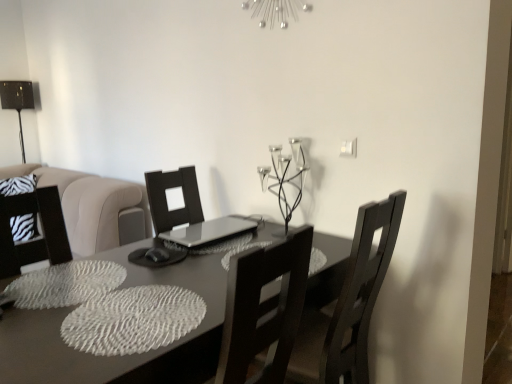
Describe the element at coordinates (119, 356) in the screenshot. I see `matte gray table at center` at that location.

What do you see at coordinates (349, 304) in the screenshot?
I see `dark wood chair at center` at bounding box center [349, 304].

In order to click on metallic black table lamp at left in this screenshot , I will do `click(17, 102)`.

Locate an element on the screen. silver metallic light fixture at upper center is located at coordinates (275, 11).

Does metallic black candle holder at upper center contain metallic black table lamp at left?

That's incorrect, metallic black table lamp at left is not inside metallic black candle holder at upper center.

Considering the sizes of objects metallic black candle holder at upper center and metallic black table lamp at left in the image provided, who is thinner, metallic black candle holder at upper center or metallic black table lamp at left?

metallic black table lamp at left is thinner.

I want to click on table lamp to the left of metallic black candle holder at upper center, so click(x=17, y=102).

Is metallic black candle holder at upper center facing towards metallic black table lamp at left?

No, metallic black candle holder at upper center is not facing towards metallic black table lamp at left.

From their relative heights in the image, would you say matte gray table at center is taller or shorter than metallic black table lamp at left?

Considering their sizes, matte gray table at center has more height than metallic black table lamp at left.

From a real-world perspective, who is located higher, matte gray table at center or metallic black table lamp at left?

From a 3D spatial view, metallic black table lamp at left is above.

Considering the relative sizes of matte gray table at center and metallic black table lamp at left in the image provided, is matte gray table at center smaller than metallic black table lamp at left?

Incorrect, matte gray table at center is not smaller in size than metallic black table lamp at left.

Is matte gray table at center surrounding metallic black table lamp at left?

No, metallic black table lamp at left is not surrounded by matte gray table at center.

Who is shorter, metallic black table lamp at left or metallic black candle holder at upper center?

metallic black candle holder at upper center.

From a real-world perspective, which is physically below, metallic black table lamp at left or metallic black candle holder at upper center?

metallic black candle holder at upper center.

Considering the relative sizes of metallic black table lamp at left and metallic black candle holder at upper center in the image provided, is metallic black table lamp at left thinner than metallic black candle holder at upper center?

Indeed, metallic black table lamp at left has a lesser width compared to metallic black candle holder at upper center.

Who is bigger, metallic black table lamp at left or metallic black candle holder at upper center?

metallic black table lamp at left is bigger.

Which of these two, metallic black table lamp at left or silver metallic light fixture at upper center, is smaller?

silver metallic light fixture at upper center is smaller.

Is metallic black table lamp at left positioned with its back to silver metallic light fixture at upper center?

That's not correct — metallic black table lamp at left is not looking away from silver metallic light fixture at upper center.

From a real-world perspective, is metallic black table lamp at left beneath silver metallic light fixture at upper center?

Yes, from a real-world perspective, metallic black table lamp at left is below silver metallic light fixture at upper center.

What's the angular difference between metallic black table lamp at left and silver metallic light fixture at upper center's facing directions?

Result: They differ by 88.9 degrees in their facing directions.

Is matte gray table at center to the left or to the right of metallic black candle holder at upper center in the image?

matte gray table at center is positioned on metallic black candle holder at upper center's left side.

The height and width of the screenshot is (384, 512). I want to click on table located below the metallic black candle holder at upper center (from the image's perspective), so click(119, 356).

Does matte gray table at center have a lesser width compared to metallic black candle holder at upper center?

No.

Is matte gray table at center taller or shorter than metallic black candle holder at upper center?

In the image, matte gray table at center appears to be taller than metallic black candle holder at upper center.

Which is more to the right, metallic black table lamp at left or dark wood chair at center?

Positioned to the right is dark wood chair at center.

You are a GUI agent. You are given a task and a screenshot of the screen. Output one action in this format:
    pyautogui.click(x=<x>, y=<y>)
    Task: Click on the chair lying in front of the metallic black table lamp at left
    
    Given the screenshot: What is the action you would take?
    pyautogui.click(x=349, y=304)

Is metallic black table lamp at left bigger than dark wood chair at center?

No.

From the image's perspective, which one is positioned lower, metallic black table lamp at left or dark wood chair at center?

dark wood chair at center, from the image's perspective.

From a real-world perspective, is matte gray table at center positioned above or below silver metallic light fixture at upper center?

In terms of real-world spatial position, matte gray table at center is below silver metallic light fixture at upper center.

Which is more distant, (x=203, y=342) or (x=253, y=15)?

The point (x=253, y=15) is farther.

Locate an element on the screen. The width and height of the screenshot is (512, 384). light fixture that appears above the matte gray table at center (from the image's perspective) is located at coordinates (275, 11).

Between matte gray table at center and silver metallic light fixture at upper center, which one has smaller width?

silver metallic light fixture at upper center.

Find the location of `candle holder that appears on the right of metallic black table lamp at left`. candle holder that appears on the right of metallic black table lamp at left is located at coordinates (285, 178).

This screenshot has width=512, height=384. I want to click on table lamp lying above the matte gray table at center (from the image's perspective), so click(x=17, y=102).

Estimate the real-world distances between objects in this image. Which object is closer to matte gray table at center, metallic black candle holder at upper center or metallic black table lamp at left?

metallic black candle holder at upper center is closer to matte gray table at center.

Based on their spatial positions, is dark wood chair at center or metallic black table lamp at left further from metallic black candle holder at upper center?

The object further to metallic black candle holder at upper center is metallic black table lamp at left.

Based on their spatial positions, is metallic black candle holder at upper center or silver metallic light fixture at upper center further from dark wood chair at center?

Result: silver metallic light fixture at upper center is positioned further to the anchor dark wood chair at center.

Which object lies further to the anchor point metallic black table lamp at left, metallic black candle holder at upper center or silver metallic light fixture at upper center?

metallic black candle holder at upper center.

Based on their spatial positions, is metallic black table lamp at left or metallic black candle holder at upper center further from dark wood chair at center?

metallic black table lamp at left lies further to dark wood chair at center than the other object.

From the image, which object appears to be nearer to metallic black table lamp at left, dark wood chair at center or matte gray table at center?

matte gray table at center.

Which object lies further to the anchor point silver metallic light fixture at upper center, dark wood chair at center or metallic black candle holder at upper center?

dark wood chair at center is further to silver metallic light fixture at upper center.

From the picture: Estimate the real-world distances between objects in this image. Which object is further from dark wood chair at center, metallic black table lamp at left or matte gray table at center?

Based on the image, metallic black table lamp at left appears to be further to dark wood chair at center.

This screenshot has height=384, width=512. What are the coordinates of `candle holder between metallic black table lamp at left and dark wood chair at center` in the screenshot? It's located at (285, 178).

Where is `candle holder located between matte gray table at center and metallic black table lamp at left in the depth direction`? The image size is (512, 384). candle holder located between matte gray table at center and metallic black table lamp at left in the depth direction is located at coordinates (285, 178).

Where is `light fixture situated between metallic black table lamp at left and metallic black candle holder at upper center from left to right`? The image size is (512, 384). light fixture situated between metallic black table lamp at left and metallic black candle holder at upper center from left to right is located at coordinates (275, 11).

This screenshot has width=512, height=384. I want to click on light fixture between matte gray table at center and metallic black table lamp at left in the front-back direction, so click(x=275, y=11).